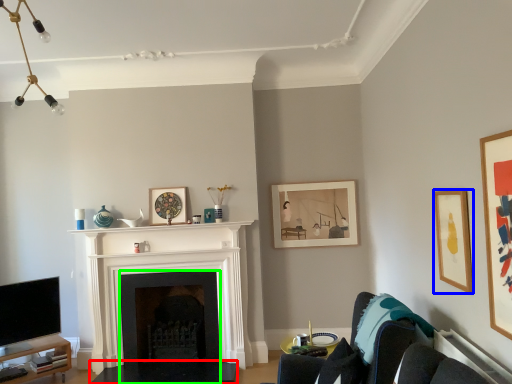
Question: Which is nearer to the table (highlighted by a red box)? picture frame (highlighted by a blue box) or fireplace (highlighted by a green box).

Choices:
 (A) picture frame
 (B) fireplace

Answer: (B)